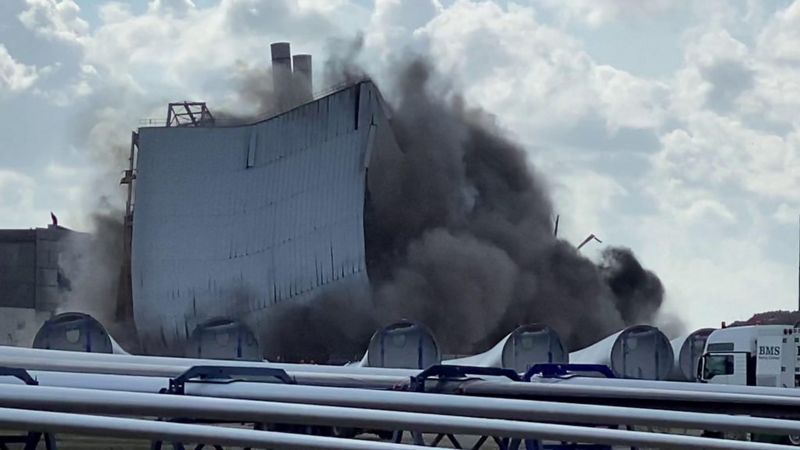
I want to click on window, so click(x=718, y=370).